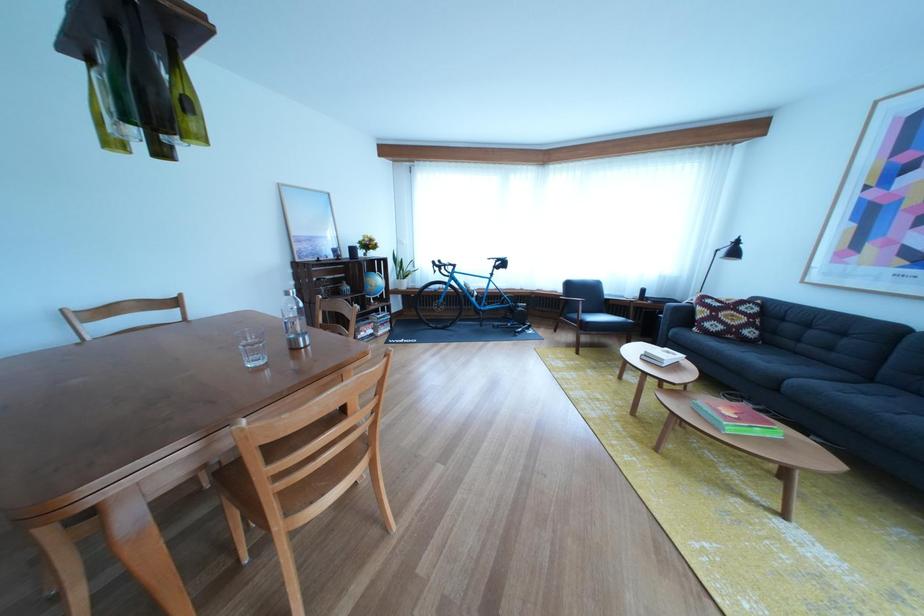
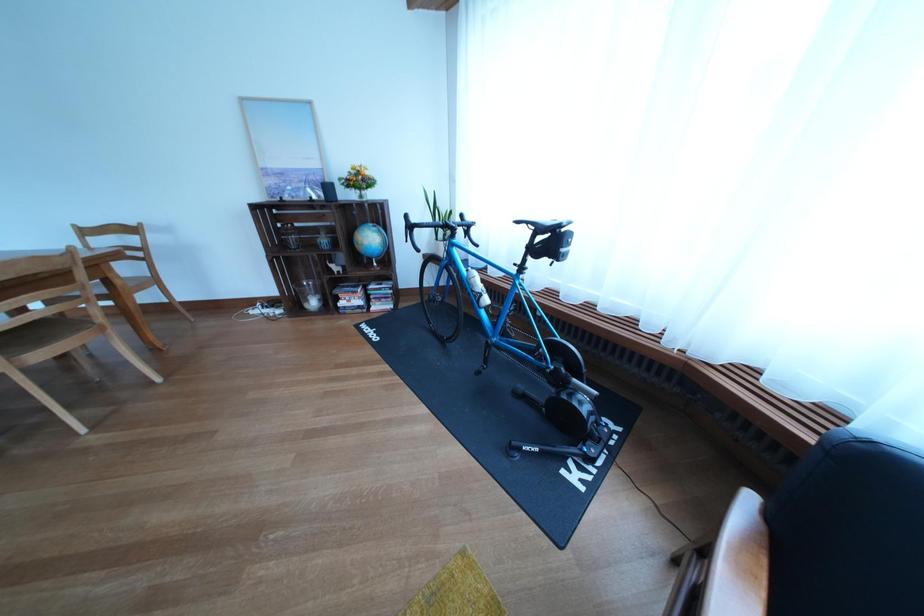
The point at [516,270] is marked in the first image. Where is the corresponding point in the second image?

(563, 248)